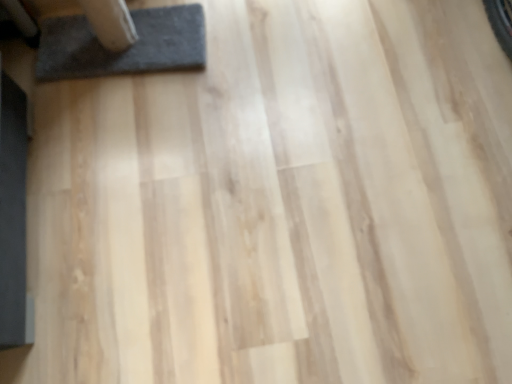
Image resolution: width=512 pixels, height=384 pixels. Find the location of `vacant area that lies to the right of black rubber mat at upper left`. vacant area that lies to the right of black rubber mat at upper left is located at coordinates (249, 56).